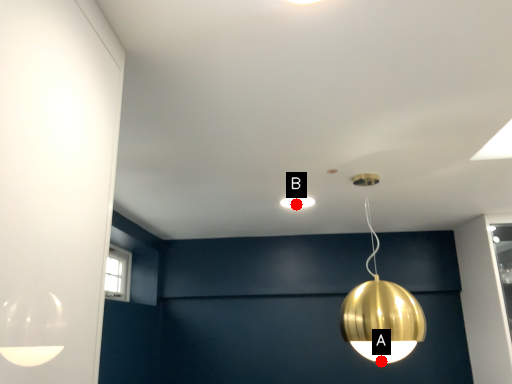
Question: Two points are circled on the image, labeled by A and B beside each circle. Which point is closer to the camera?

Choices:
 (A) A is closer
 (B) B is closer

Answer: (A)